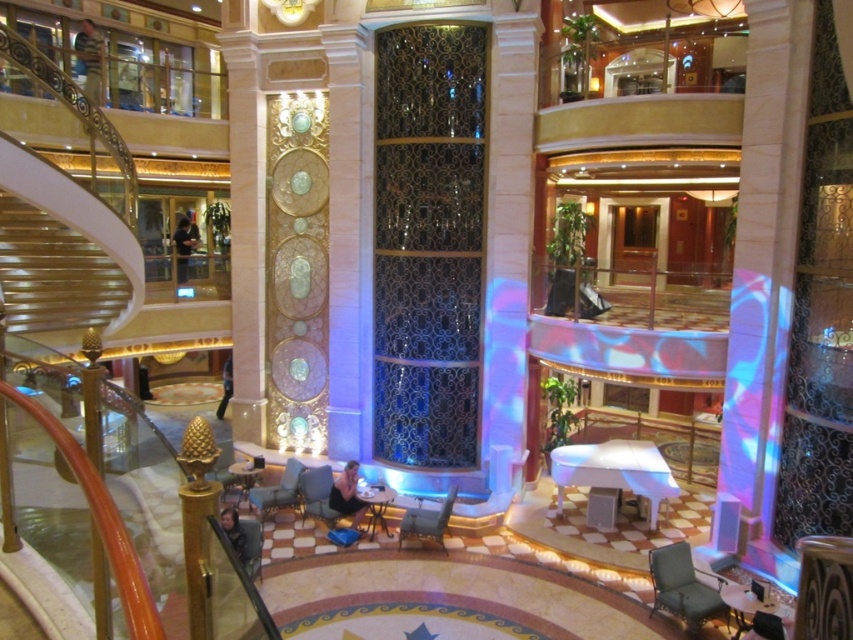
You are a guest at this luxurious venue and want to pick up both the light brown leather jacket at upper left and the dark brown leather jacket at lower left. Which jacket will you reach first if you move directly towards them?

You will reach the light brown leather jacket at upper left first because it is closer to you than the dark brown leather jacket at lower left.

You are a guest at this luxurious venue and want to sit down. You notice the dark blue fabric at center and the black shirt at center. Which object would you avoid sitting on to ensure comfort?

You should avoid sitting on the dark blue fabric at center because it occupies less space than the black shirt at center, suggesting it might be a smaller item like a cushion or tablecloth rather than a seating option.

Consider the image. You are a photographer planning to capture a photo of the black shirt at center and dark blue jeans at lower left. Considering their sizes, which object should you focus on first to ensure both are in frame without moving the camera?

You should focus on the dark blue jeans at lower left first because it occupies more space than the black shirt at center, ensuring it fits within the frame before adjusting for the smaller object.